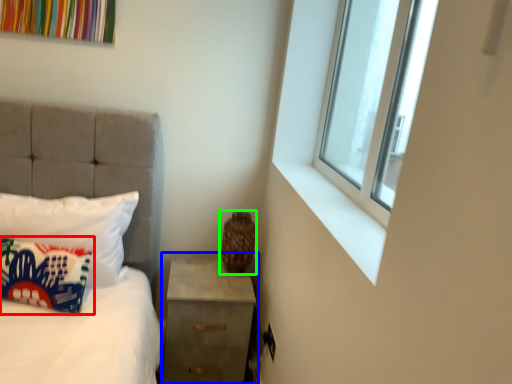
Question: Estimate the real-world distances between objects in this image. Which object is closer to pillow (highlighted by a red box), nightstand (highlighted by a blue box) or vase (highlighted by a green box)?

Choices:
 (A) nightstand
 (B) vase

Answer: (A)